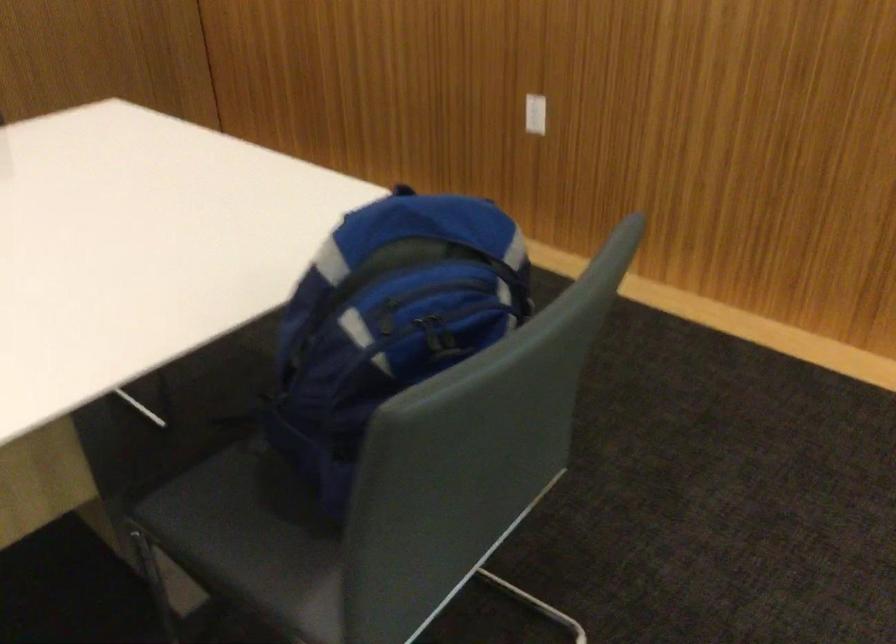
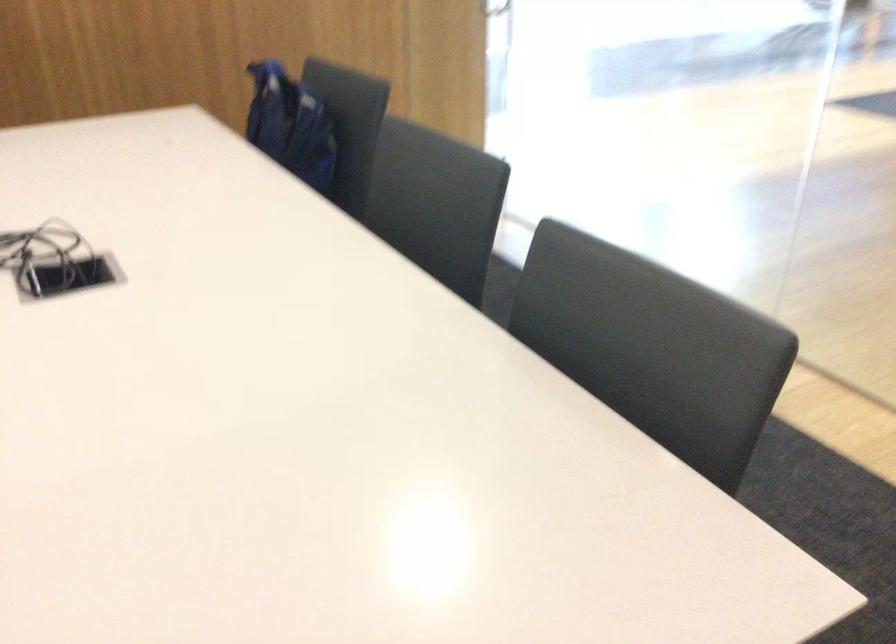
In the second image, find the point that corresponds to point (354, 351) in the first image.

(289, 125)